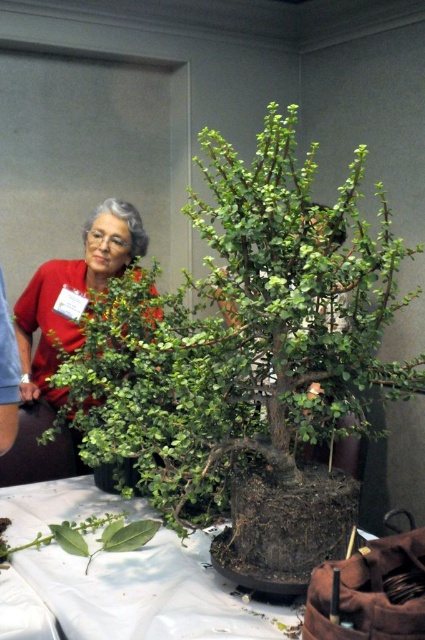
Question: Which object appears farthest from the camera in this image?

Choices:
 (A) green matte bonsai tree at center
 (B) white fabric table at center
 (C) matte red blouse at center

Answer: (C)

Question: Which object appears closest to the camera in this image?

Choices:
 (A) matte red blouse at center
 (B) white fabric table at center

Answer: (B)

Question: Which is nearer to the matte red blouse at center?

Choices:
 (A) green matte bonsai tree at center
 (B) white fabric table at center

Answer: (A)

Question: Is green matte bonsai tree at center to the left of white fabric table at center from the viewer's perspective?

Choices:
 (A) no
 (B) yes

Answer: (A)

Question: Does green matte bonsai tree at center have a smaller size compared to white fabric table at center?

Choices:
 (A) no
 (B) yes

Answer: (A)

Question: Does white fabric table at center appear on the left side of matte red blouse at center?

Choices:
 (A) no
 (B) yes

Answer: (A)